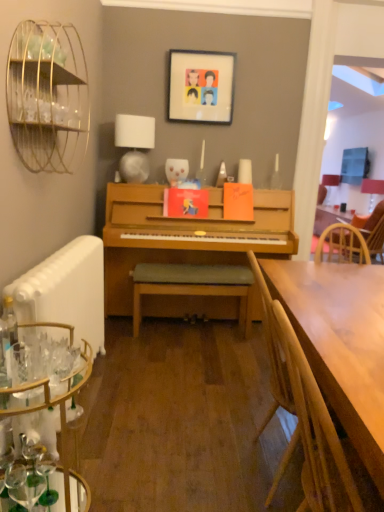
Question: Could matte plastic picture frame at upper center be considered to be inside white fabric lampshade at upper center, the 1th lamp when ordered from left to right?

Choices:
 (A) yes
 (B) no

Answer: (B)

Question: Does white fabric lampshade at upper center, which ranks as the 2th lamp in right-to-left order, lie in front of matte plastic picture frame at upper center?

Choices:
 (A) no
 (B) yes

Answer: (B)

Question: Is white fabric lampshade at upper center, the first lamp in the front-to-back sequence, to the right of matte plastic picture frame at upper center from the viewer's perspective?

Choices:
 (A) yes
 (B) no

Answer: (B)

Question: Is the surface of white fabric lampshade at upper center, the 1th lamp when ordered from left to right, in direct contact with matte plastic picture frame at upper center?

Choices:
 (A) no
 (B) yes

Answer: (A)

Question: Does white fabric lampshade at upper center, placed as the 2th lamp when sorted from back to front, turn towards matte plastic picture frame at upper center?

Choices:
 (A) yes
 (B) no

Answer: (B)

Question: From a real-world perspective, is white fabric lampshade at upper center, the 1th lamp when ordered from left to right, positioned under matte plastic picture frame at upper center based on gravity?

Choices:
 (A) no
 (B) yes

Answer: (B)

Question: Is white fabric lampshade at upper center, the 1th lamp when ordered from left to right, positioned with its back to wooden chair at right, positioned as the 1th chair in top-to-bottom order?

Choices:
 (A) no
 (B) yes

Answer: (A)

Question: From a real-world perspective, is white fabric lampshade at upper center, placed as the 2th lamp when sorted from back to front, positioned over wooden chair at right, the 2th chair from the front, based on gravity?

Choices:
 (A) no
 (B) yes

Answer: (B)

Question: Is white fabric lampshade at upper center, which ranks as the 2th lamp in right-to-left order, not near wooden chair at right, placed as the second chair when sorted from bottom to top?

Choices:
 (A) yes
 (B) no

Answer: (A)

Question: Considering the relative sizes of white fabric lampshade at upper center, the first lamp in the front-to-back sequence, and wooden chair at right, the second chair from the left, in the image provided, is white fabric lampshade at upper center, the first lamp in the front-to-back sequence, shorter than wooden chair at right, the second chair from the left,?

Choices:
 (A) yes
 (B) no

Answer: (A)

Question: Considering the relative positions of white fabric lampshade at upper center, the first lamp in the front-to-back sequence, and wooden chair at right, the second chair from the left, in the image provided, is white fabric lampshade at upper center, the first lamp in the front-to-back sequence, to the left of wooden chair at right, the second chair from the left, from the viewer's perspective?

Choices:
 (A) no
 (B) yes

Answer: (B)

Question: From the image's perspective, is white fabric lampshade at upper center, placed as the 2th lamp when sorted from back to front, over wooden chair at right, the 2th chair from the front?

Choices:
 (A) yes
 (B) no

Answer: (A)

Question: Is gold wire birdcage at upper left outside of clear glass desk at lower left?

Choices:
 (A) yes
 (B) no

Answer: (A)